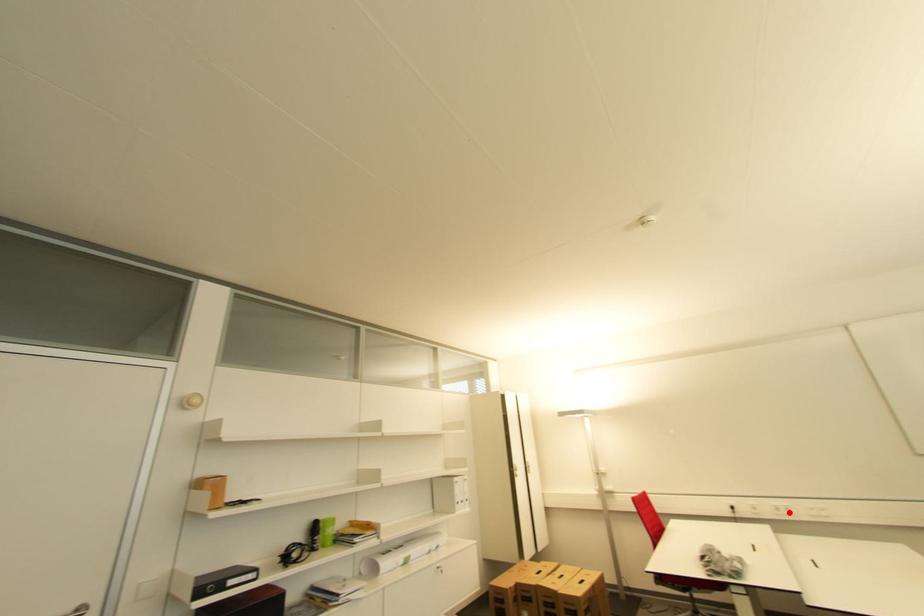
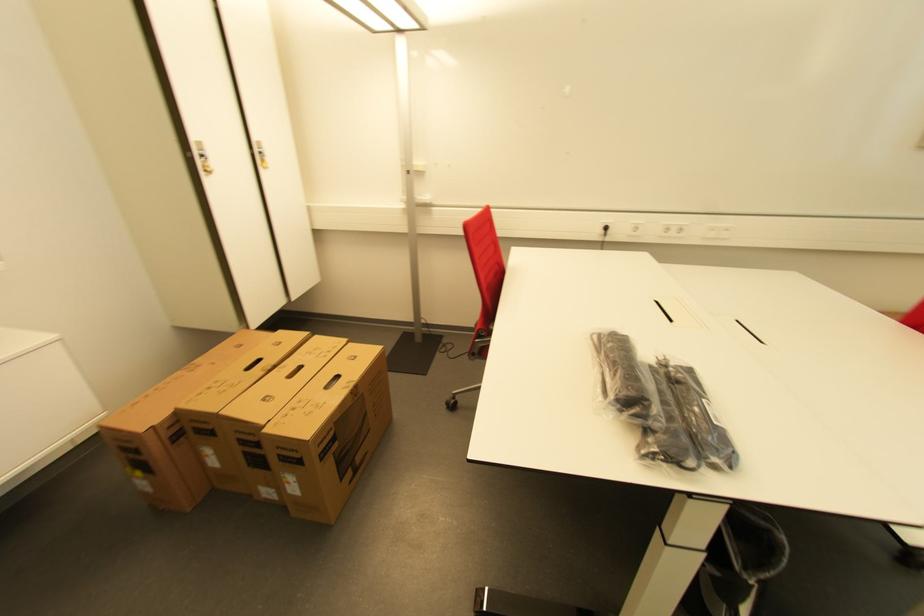
Where in the second image is the point corresponding to the highlighted location from the first image?

(676, 233)